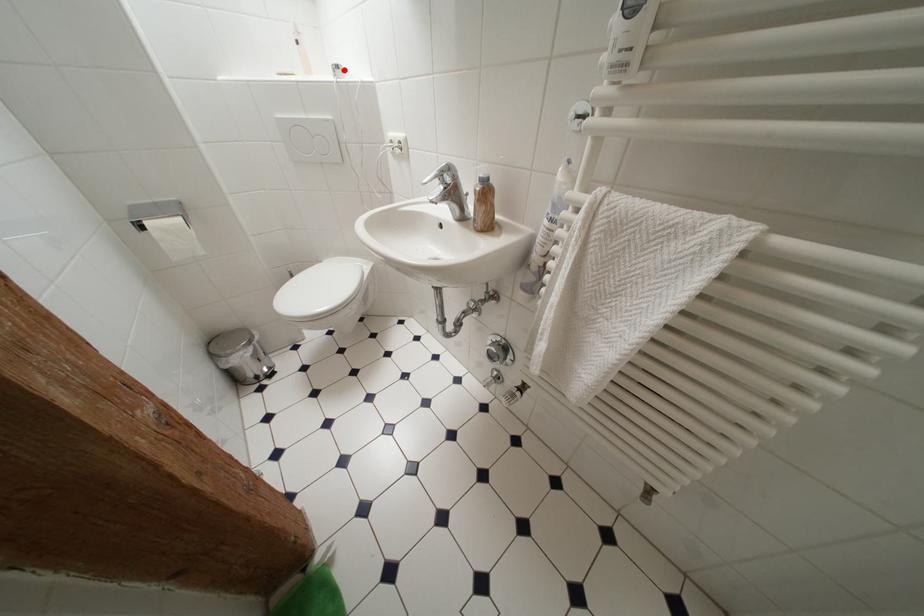
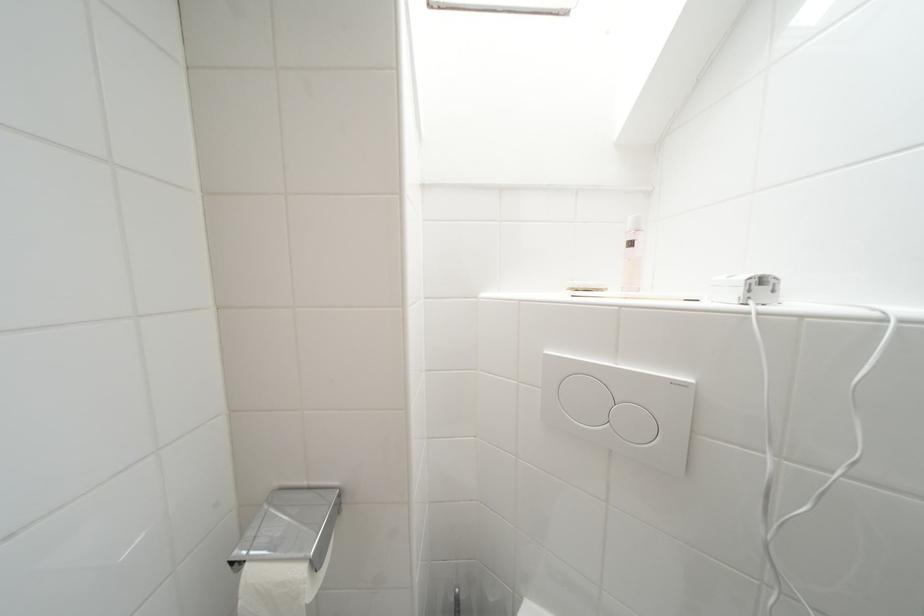
Find the pixel in the second image that matches the highlighted location in the first image.

(769, 283)